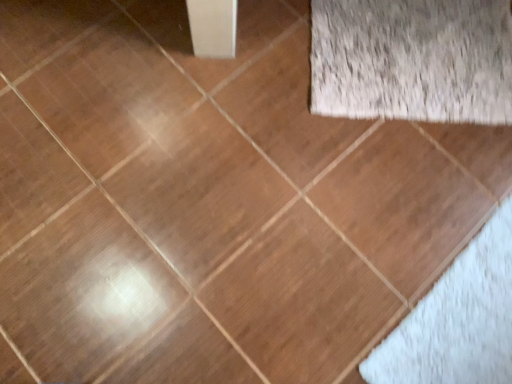
Locate an element on the screen. The width and height of the screenshot is (512, 384). vacant space in front of white fluffy rug at upper right is located at coordinates (390, 198).